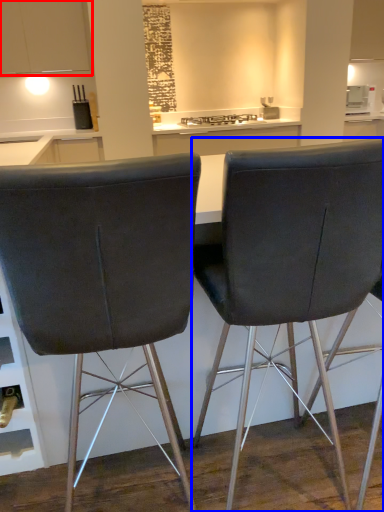
Question: Among these objects, which one is nearest to the camera, cabinetry (highlighted by a red box) or chair (highlighted by a blue box)?

Choices:
 (A) cabinetry
 (B) chair

Answer: (B)